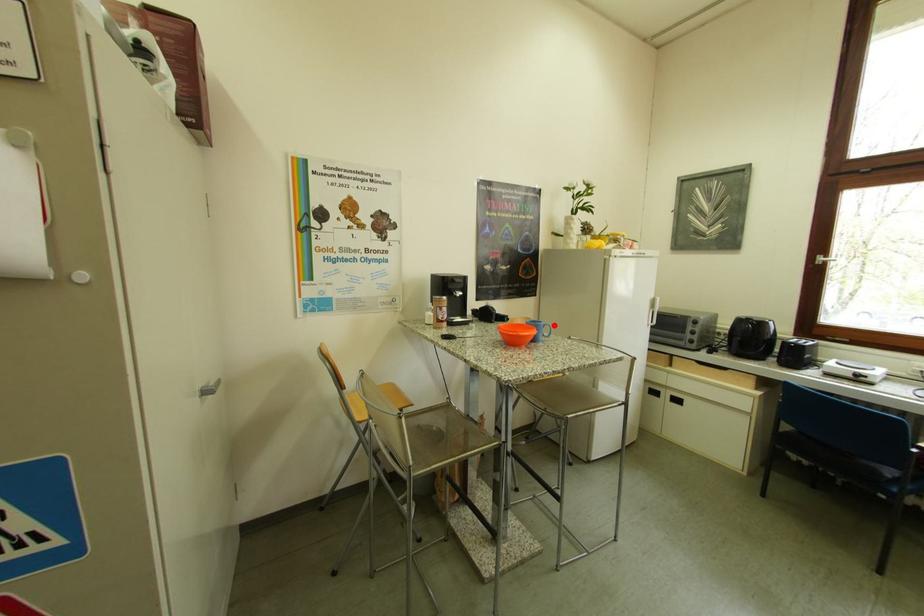
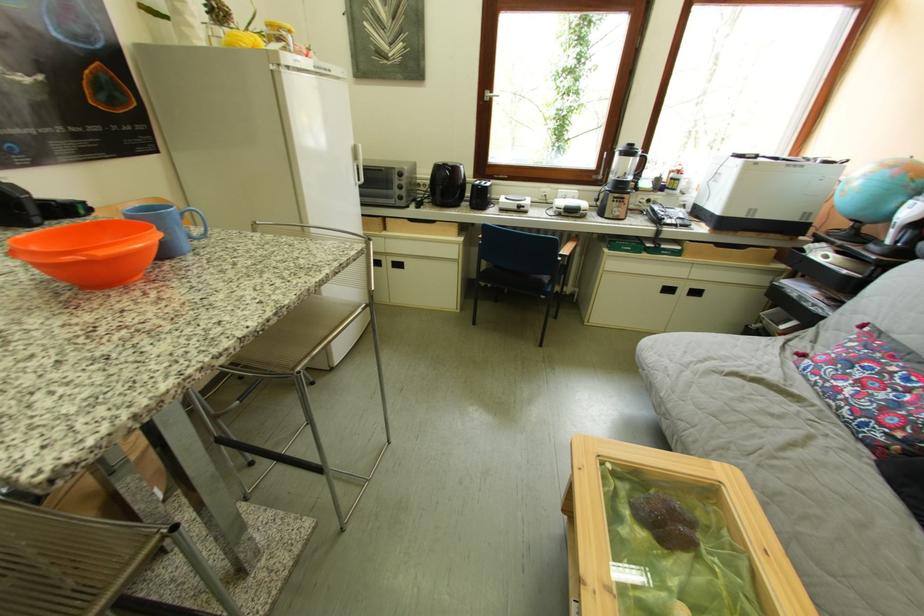
Question: I am providing you with two images of the same scene from different viewpoints. A red point is marked on the first image. At the location where the point appears in image 1, is it still visible in image 2?

Choices:
 (A) Yes
 (B) No

Answer: (A)